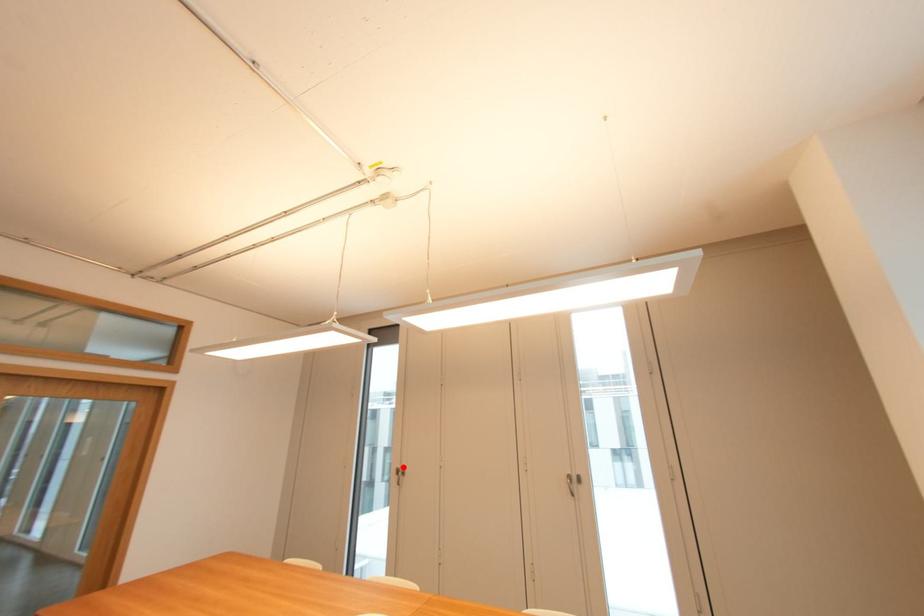
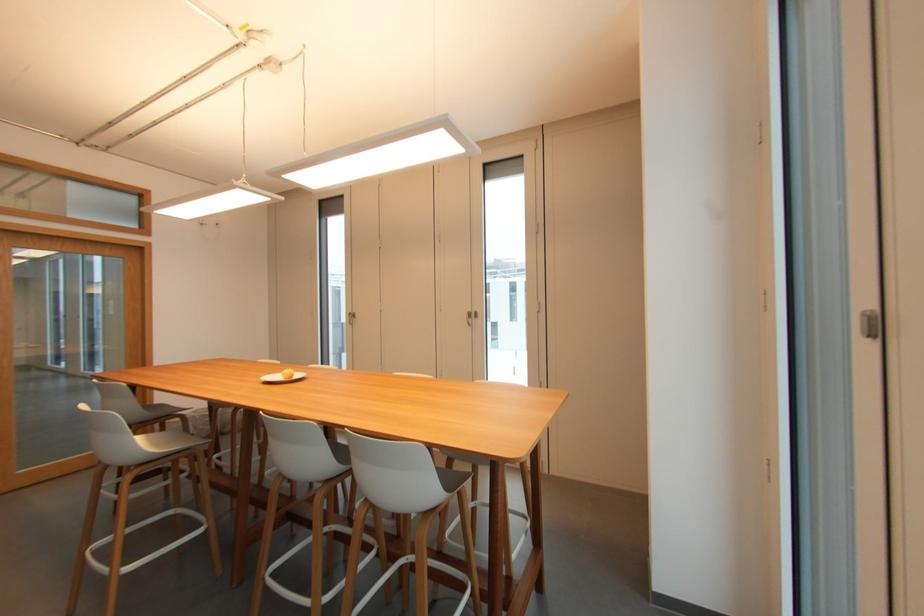
Question: I am providing you with two images of the same scene from different viewpoints. A red point is marked on the first image. At the location where the point appears in image 1, is it still visible in image 2?

Choices:
 (A) Yes
 (B) No

Answer: (A)